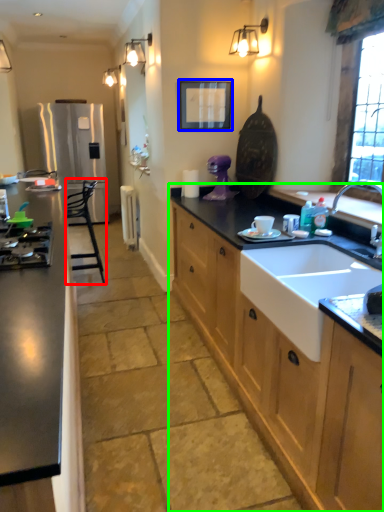
Question: Estimate the real-world distances between objects in this image. Which object is closer to chair (highlighted by a red box), picture frame (highlighted by a blue box) or cabinetry (highlighted by a green box)?

Choices:
 (A) picture frame
 (B) cabinetry

Answer: (A)